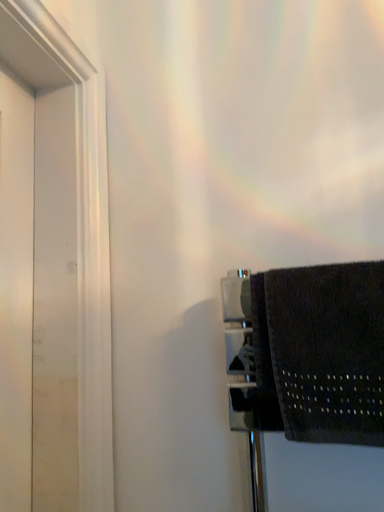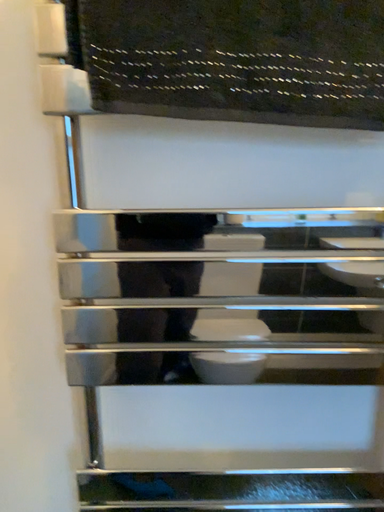
Question: How did the camera likely rotate when shooting the video?

Choices:
 (A) rotated left
 (B) rotated right

Answer: (B)